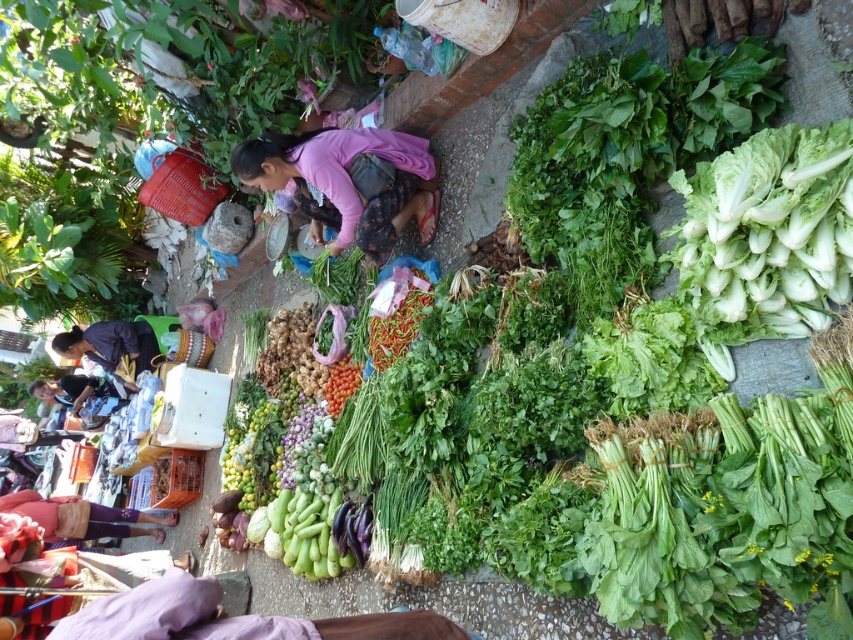
Please look at the image and identify the object located at the coordinates point [347,182]. What is it?

The object at point [347,182] is the pink fabric at center.